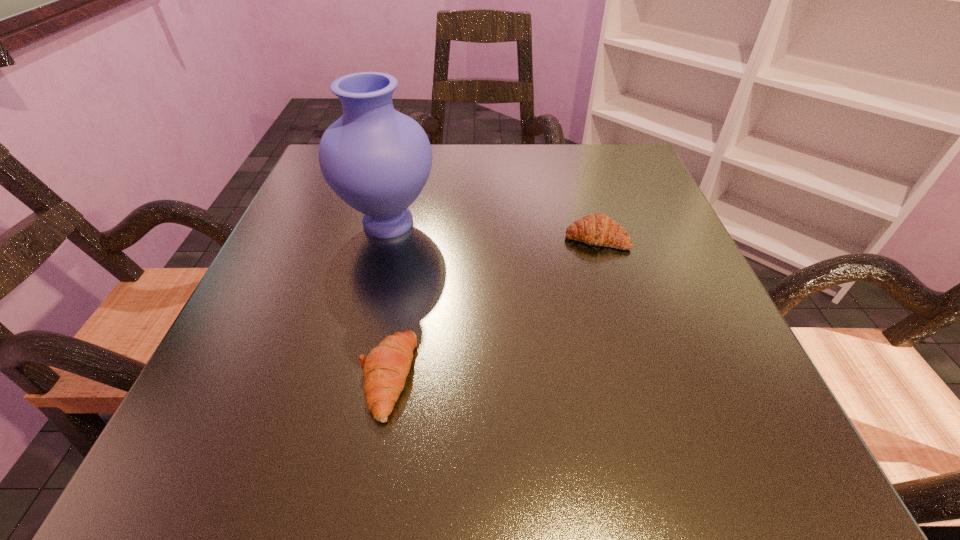
Where is `free space between the rightmost object and the tallest object`? This screenshot has width=960, height=540. free space between the rightmost object and the tallest object is located at coordinates (492, 231).

Identify the location of blank region between the right crescent roll and the tallest object. (492, 231).

Find the location of a particular element. vacant area that lies between the tallest object and the left crescent roll is located at coordinates (388, 300).

Identify the location of vacant space that's between the right crescent roll and the nearest object. (492, 307).

In order to click on vacant area that lies between the nearest object and the farther crescent roll in this screenshot , I will do `click(492, 307)`.

The image size is (960, 540). I want to click on free point between the nearer crescent roll and the vase, so click(x=388, y=300).

Identify the location of free space between the tallest object and the nearest object. pyautogui.click(x=388, y=300).

I want to click on free space between the right crescent roll and the nearer crescent roll, so click(492, 307).

This screenshot has width=960, height=540. Identify the location of vacant region between the left crescent roll and the right crescent roll. (492, 307).

The width and height of the screenshot is (960, 540). I want to click on vacant point located between the vase and the rightmost object, so click(492, 231).